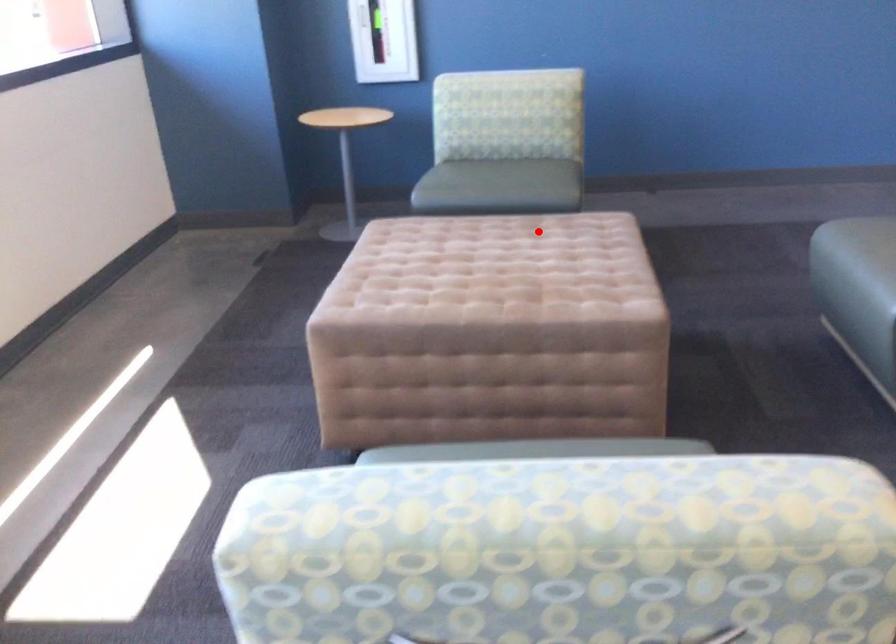
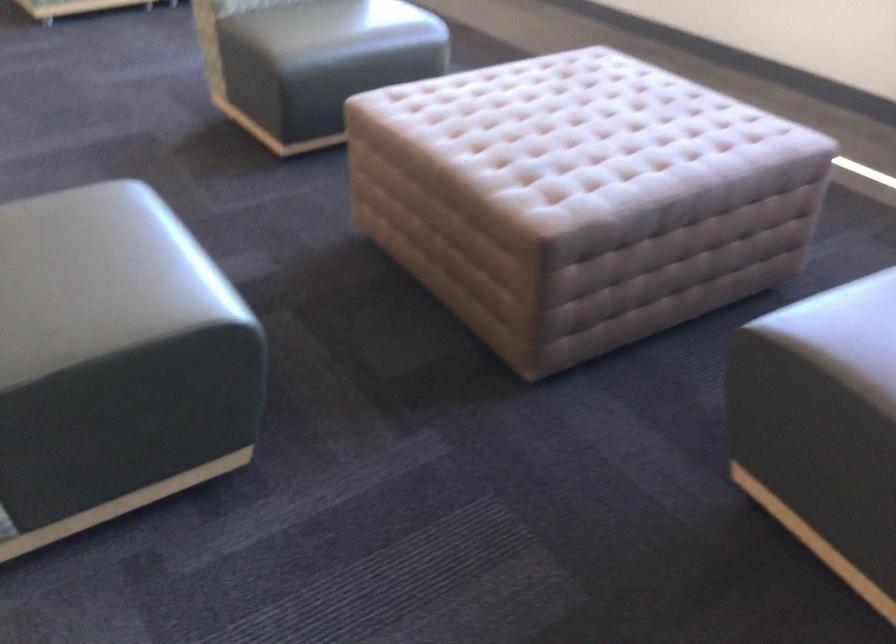
Find the pixel in the second image that matches the highlighted location in the first image.

(586, 147)